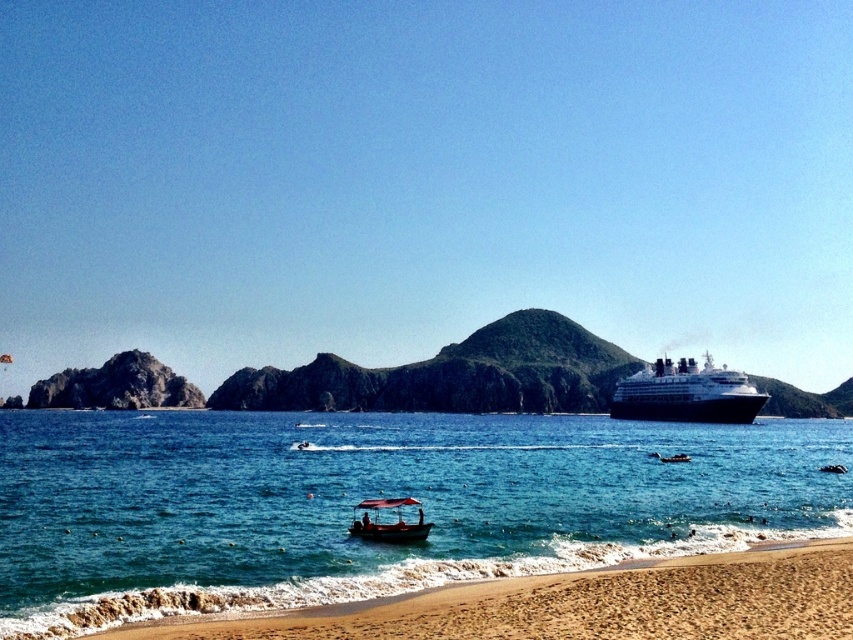
Can you confirm if clear blue water at lower center is taller than black glossy cruise ship at right?

In fact, clear blue water at lower center may be shorter than black glossy cruise ship at right.

Does clear blue water at lower center have a greater width compared to black glossy cruise ship at right?

Yes, clear blue water at lower center is wider than black glossy cruise ship at right.

Between point (274, 536) and point (746, 381), which one is positioned behind?

Point (746, 381)

Find the location of a particular element. The height and width of the screenshot is (640, 853). clear blue water at lower center is located at coordinates (374, 497).

Who is higher up, clear blue water at lower center or sandy beach at lower right?

sandy beach at lower right

Does point (65, 449) lie behind point (759, 624)?

Yes.

Where is `clear blue water at lower center`? The width and height of the screenshot is (853, 640). clear blue water at lower center is located at coordinates (374, 497).

Is sandy beach at lower right further to the viewer compared to wooden boat at center?

No.

Between point (659, 618) and point (370, 528), which one is positioned behind?

The point (370, 528) is more distant.

Is point (321, 630) positioned behind point (381, 532)?

No, (321, 630) is closer to viewer.

Where is `sandy beach at lower right`? sandy beach at lower right is located at coordinates (579, 604).